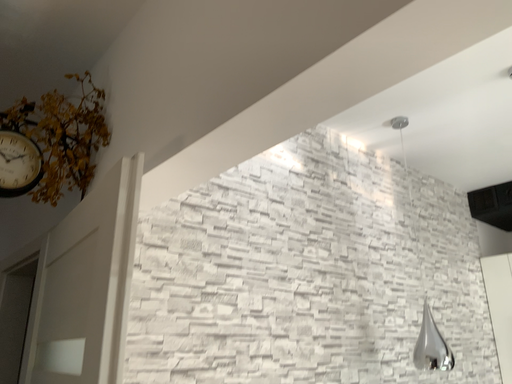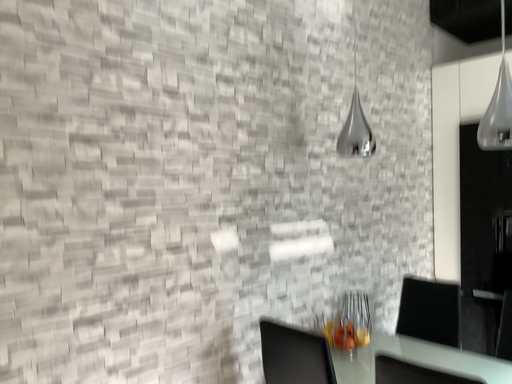
Question: Which way did the camera rotate in the video?

Choices:
 (A) rotated downward
 (B) rotated upward

Answer: (A)